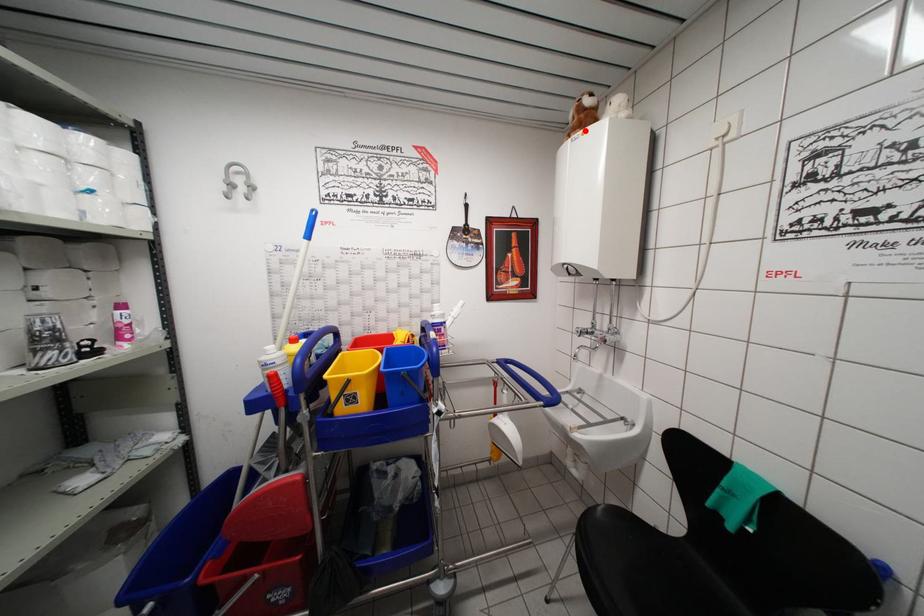
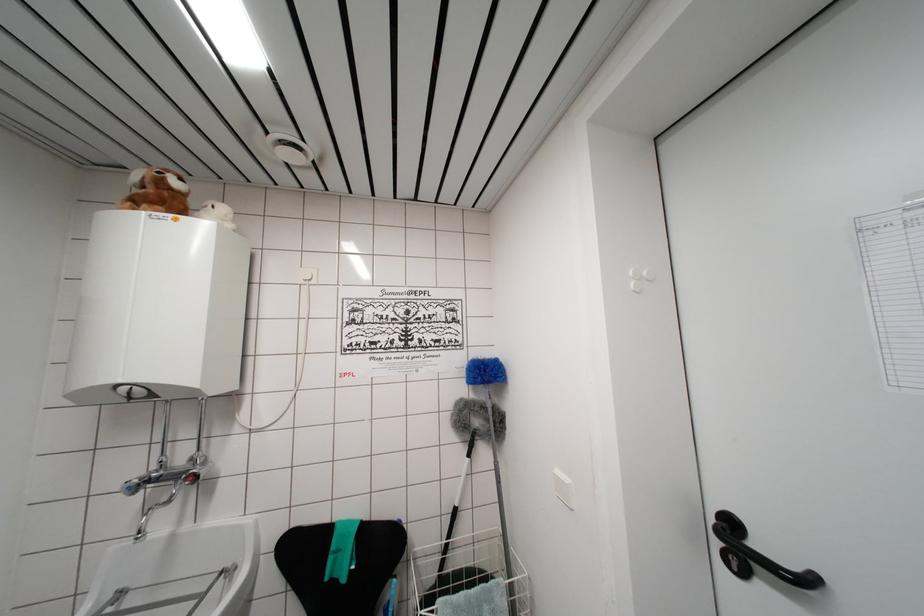
Question: I am providing you with two images of the same scene from different viewpoints. A red point is marked on the first image. At the location where the point appears in image 1, is it still visible in image 2?

Choices:
 (A) Yes
 (B) No

Answer: (A)